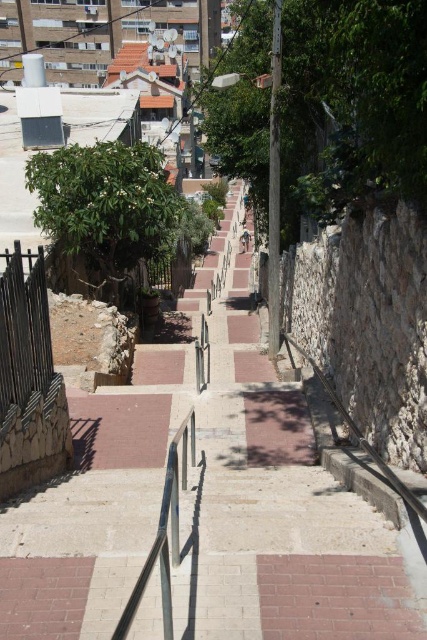
Question: Which object is closer to the camera taking this photo?

Choices:
 (A) brick pavement at center
 (B) polished metal rail at center

Answer: (B)

Question: Which point is closer to the camera taking this photo?

Choices:
 (A) (131, 621)
 (B) (204, 452)

Answer: (A)

Question: Does brick pavement at center come in front of polished metal rail at center?

Choices:
 (A) no
 (B) yes

Answer: (A)

Question: Is brick pavement at center positioned in front of polished metal rail at center?

Choices:
 (A) no
 (B) yes

Answer: (A)

Question: Is brick pavement at center above polished metal rail at center?

Choices:
 (A) no
 (B) yes

Answer: (B)

Question: Among these objects, which one is farthest from the camera?

Choices:
 (A) polished metal rail at center
 (B) brick pavement at center

Answer: (B)